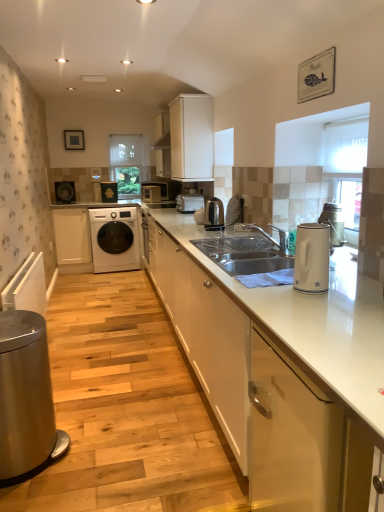
This screenshot has width=384, height=512. In order to click on unoccupied region to the right of brushed metal trash can at lower left, the 1th home appliance positioned from the bottom in this screenshot , I will do `click(109, 456)`.